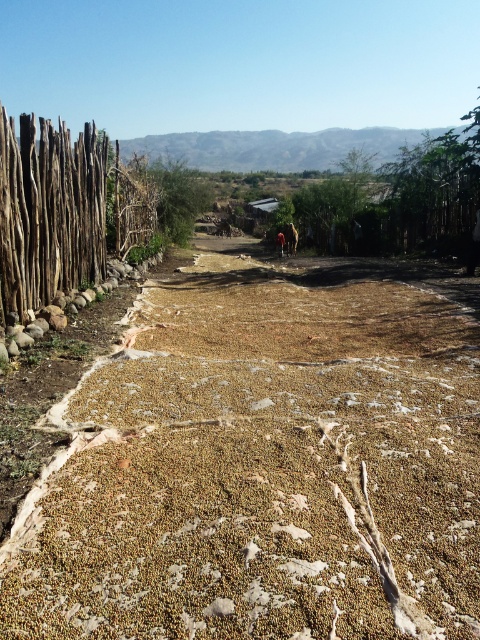
Question: Estimate the real-world distances between objects in this image. Which object is farther from the green leafy tree at center?

Choices:
 (A) brown wooden fence at left
 (B) brown rough dirt field at center

Answer: (B)

Question: Which point is closer to the camera?

Choices:
 (A) (3, 588)
 (B) (14, 268)
 (C) (171, 177)

Answer: (A)

Question: Can you confirm if brown rough dirt field at center is positioned above brown wooden fence at left?

Choices:
 (A) no
 (B) yes

Answer: (A)

Question: Which object appears closest to the camera in this image?

Choices:
 (A) green leafy tree at center
 (B) brown rough dirt field at center
 (C) brown wooden fence at left

Answer: (B)

Question: Does brown rough dirt field at center have a larger size compared to green leafy tree at center?

Choices:
 (A) yes
 (B) no

Answer: (B)

Question: Can you confirm if brown wooden fence at left is positioned to the right of green leafy tree at center?

Choices:
 (A) yes
 (B) no

Answer: (A)